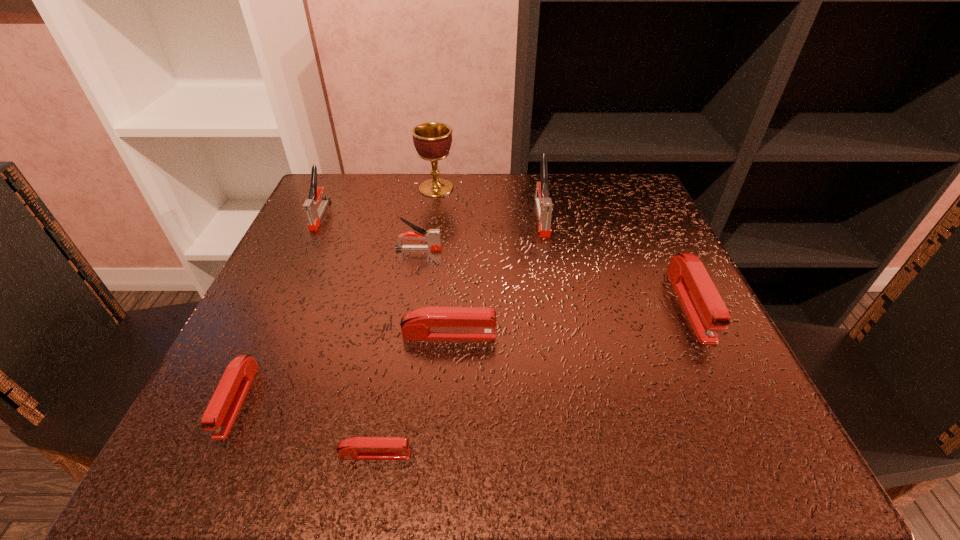
Image resolution: width=960 pixels, height=540 pixels. What are the coordinates of `blank area located 0.110m on the front-facing side of the rightmost stapler` in the screenshot? It's located at (x=741, y=407).

Find the location of a particular element. Image resolution: width=960 pixels, height=540 pixels. free space located on the front-facing side of the sixth tallest object is located at coordinates (662, 335).

You are a GUI agent. You are given a task and a screenshot of the screen. Output one action in this format:
    pyautogui.click(x=<x>, y=<y>)
    Task: Click on the vacant space located on the front-facing side of the smallest red stapler
    
    Given the screenshot: What is the action you would take?
    click(x=582, y=454)

In order to click on chalice located in the far edge section of the desktop in this screenshot , I will do `click(432, 140)`.

Locate an element on the screen. The height and width of the screenshot is (540, 960). object at the right edge is located at coordinates (703, 305).

This screenshot has height=540, width=960. Identify the location of object that is at the far left corner. (310, 206).

This screenshot has height=540, width=960. I want to click on object that is positioned at the near left corner, so click(x=220, y=414).

At what (x,y) coordinates should I click in order to perform the action: click on vacant space at the far edge of the desktop. Please return your answer as a coordinate pair (x, y). This screenshot has height=540, width=960. Looking at the image, I should click on (379, 213).

Where is `vacant region at the left edge of the desktop`? vacant region at the left edge of the desktop is located at coordinates (280, 268).

The width and height of the screenshot is (960, 540). Find the location of `free space at the right edge of the desktop`. free space at the right edge of the desktop is located at coordinates (636, 306).